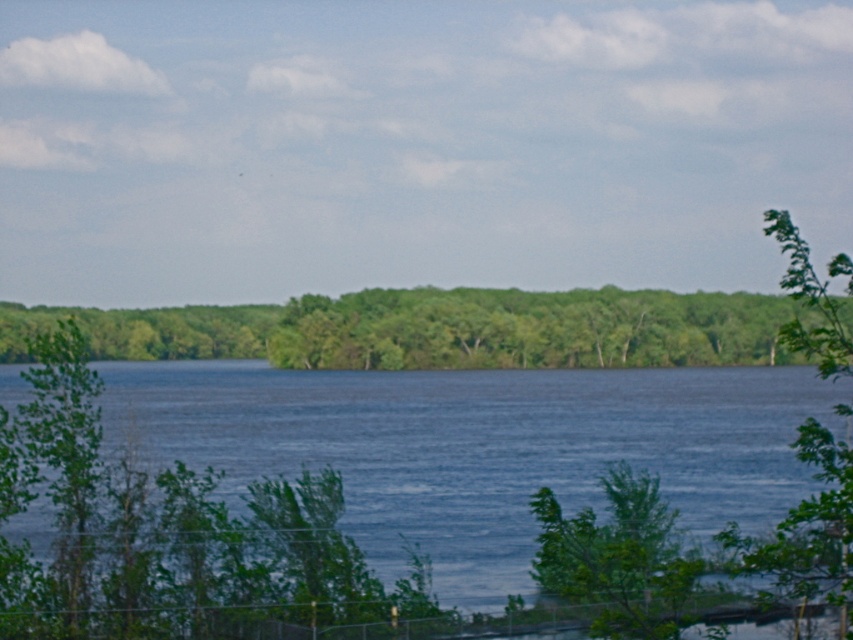
Question: Is blue water at center bigger than green leafy tree at right?

Choices:
 (A) no
 (B) yes

Answer: (B)

Question: Is blue water at center closer to the viewer compared to green leafy tree at right?

Choices:
 (A) no
 (B) yes

Answer: (A)

Question: Which object is the farthest from the green leafy tree at right?

Choices:
 (A) green leafy trees at center
 (B) blue water at center

Answer: (A)

Question: Which of these objects is positioned farthest from the blue water at center?

Choices:
 (A) green leafy tree at right
 (B) green leafy trees at center

Answer: (A)

Question: Is the position of green leafy trees at center less distant than that of green leafy tree at right?

Choices:
 (A) no
 (B) yes

Answer: (A)

Question: Which point is closer to the camera?

Choices:
 (A) green leafy tree at right
 (B) blue water at center
 (C) green leafy trees at center

Answer: (A)